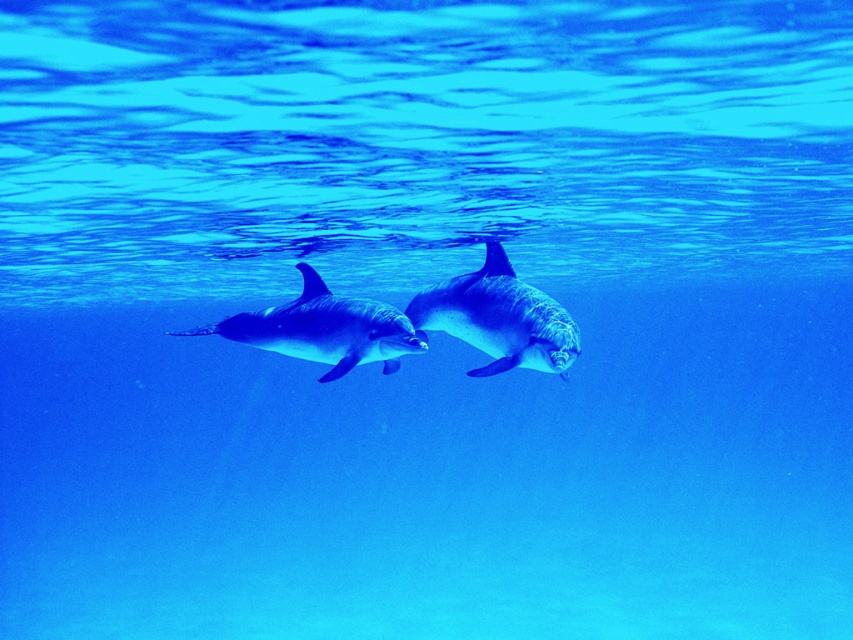
You are a marine biologist studying dolphin behavior underwater. You are positioned at a point 6.65 meters away from the camera. You want to observe the dolphins in the image. Can you see the point marked at coordinates point (509, 323)? Please explain your reasoning.

The point marked at coordinates point (509, 323) is located 6.65 meters away from the camera. Since you are positioned at a point 6.65 meters away from the camera, you are exactly at the same distance as the point. Therefore, you can see the point marked at coordinates point (509, 323) if it is within your field of view.

You are an underwater photographer aiming to capture a closeup shot of the dolphin near point (508,330) and the dolphin near point (287,337). Which dolphin should you focus on first to ensure it appears larger in your photo?

You should focus on the dolphin near point (508,330) first because it is closer to the camera and will appear larger in the photo compared to the dolphin near point (287,337).